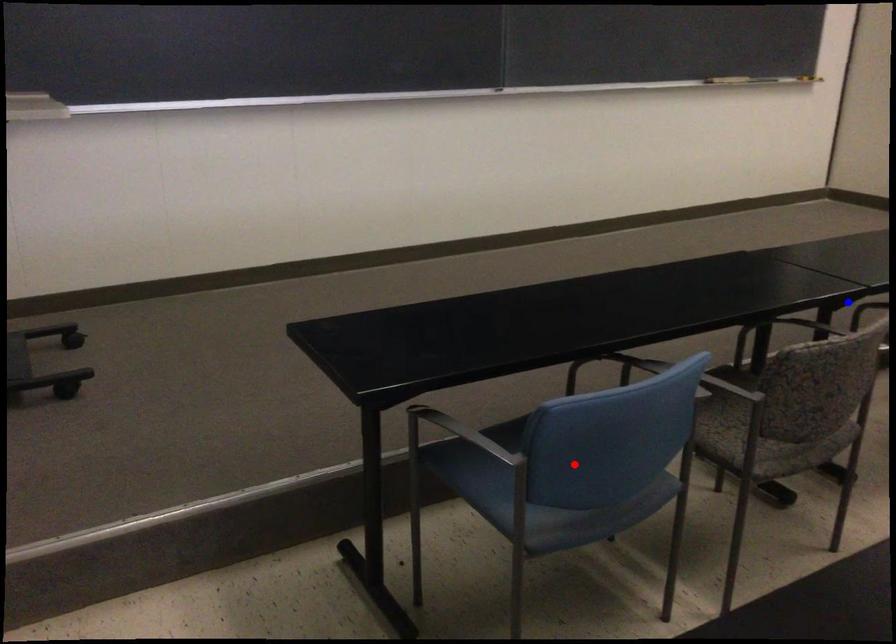
Question: In the image, two points are highlighted. Which point is nearer to the camera? Reply with the corresponding letter.

Choices:
 (A) blue point
 (B) red point

Answer: (B)